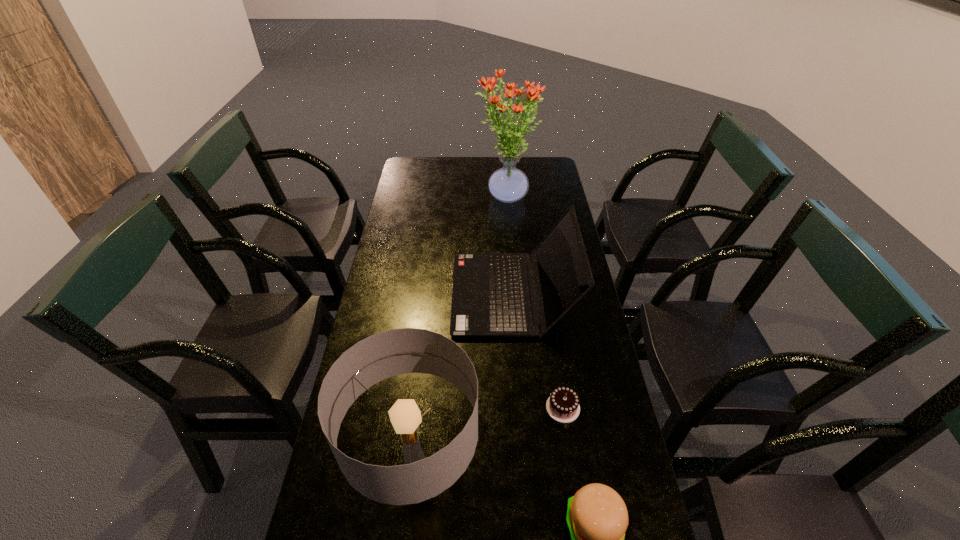
Locate an element on the screen. free spot located on the back of the shortest object is located at coordinates (554, 352).

Locate an element on the screen. Image resolution: width=960 pixels, height=540 pixels. object that is at the far edge is located at coordinates (508, 184).

Find the location of `flower arrangement situated at the right edge`. flower arrangement situated at the right edge is located at coordinates (508, 184).

Where is `laptop computer located in the right edge section of the desktop`? This screenshot has height=540, width=960. laptop computer located in the right edge section of the desktop is located at coordinates (490, 297).

You are a GUI agent. You are given a task and a screenshot of the screen. Output one action in this format:
    pyautogui.click(x=<x>, y=<y>)
    Task: Click on the chocolate cake that is at the right edge
    The height and width of the screenshot is (540, 960).
    Given the screenshot: What is the action you would take?
    [563, 406]

At what (x,y) coordinates should I click in order to perform the action: click on object that is at the far right corner. Please return your answer as a coordinate pair (x, y). The height and width of the screenshot is (540, 960). Looking at the image, I should click on (508, 184).

The height and width of the screenshot is (540, 960). What are the coordinates of `vacant space at the left edge of the desktop` in the screenshot? It's located at (366, 333).

In the image, there is a desktop. Identify the location of vacant space at the right edge. (587, 412).

Locate an element on the screen. blank space at the far left corner of the desktop is located at coordinates click(x=420, y=174).

Find the location of a particular element. The height and width of the screenshot is (540, 960). vacant space that is in between the laptop computer and the farthest object is located at coordinates (509, 246).